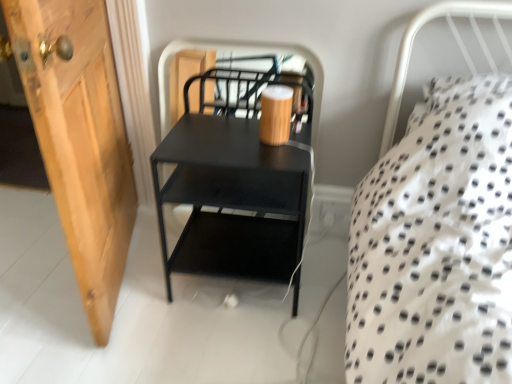
The width and height of the screenshot is (512, 384). I want to click on black matte nightstand at center, so click(x=232, y=200).

Describe the element at coordinates (232, 200) in the screenshot. I see `black matte nightstand at center` at that location.

This screenshot has height=384, width=512. I want to click on wooden door at left, so click(x=80, y=141).

What do you see at coordinates (80, 141) in the screenshot?
I see `wooden door at left` at bounding box center [80, 141].

You are a GUI agent. You are given a task and a screenshot of the screen. Output one action in this format:
    pyautogui.click(x=<x>, y=<y>)
    Task: Click on the black matte nightstand at center
    Image resolution: width=512 pixels, height=384 pixels.
    Given the screenshot: What is the action you would take?
    pyautogui.click(x=232, y=200)

Can you confirm if wooden door at left is positioned to the left of black matte nightstand at center?

Yes, wooden door at left is to the left of black matte nightstand at center.

Which object is more forward, wooden door at left or black matte nightstand at center?

wooden door at left is closer to the camera.

Which is behind, point (64, 203) or point (159, 189)?

Point (159, 189)

From the image's perspective, is wooden door at left positioned above or below black matte nightstand at center?

wooden door at left is above black matte nightstand at center.

Consider the image. From a real-world perspective, is wooden door at left above or below black matte nightstand at center?

wooden door at left is above black matte nightstand at center.

Consider the image. Considering the sizes of objects wooden door at left and black matte nightstand at center in the image provided, who is wider, wooden door at left or black matte nightstand at center?

With larger width is wooden door at left.

Who is shorter, wooden door at left or black matte nightstand at center?

Standing shorter between the two is black matte nightstand at center.

Is wooden door at left bigger or smaller than black matte nightstand at center?

wooden door at left is smaller than black matte nightstand at center.

Is wooden door at left surrounding black matte nightstand at center?

No, black matte nightstand at center is not inside wooden door at left.

Is wooden door at left beside black matte nightstand at center?

No, wooden door at left is not in contact with black matte nightstand at center.

From the picture: Is black matte nightstand at center at the back of wooden door at left?

wooden door at left does not have its back to black matte nightstand at center.

What's the angular difference between wooden door at left and black matte nightstand at center's facing directions?

15.8 degrees separate the facing orientations of wooden door at left and black matte nightstand at center.

How much distance is there between wooden door at left and black matte nightstand at center?

wooden door at left and black matte nightstand at center are 13.48 inches apart.

This screenshot has width=512, height=384. What are the coordinates of `nightstand below the wooden door at left (from the image's perspective)` in the screenshot? It's located at (232, 200).

Is black matte nightstand at center to the left or to the right of wooden door at left in the image?

From the image, it's evident that black matte nightstand at center is to the right of wooden door at left.

Is black matte nightstand at center positioned behind wooden door at left?

Yes, it is behind wooden door at left.

Based on the photo, which is nearer, (x=219, y=241) or (x=46, y=141)?

Positioned in front is point (x=46, y=141).

From the image's perspective, relative to wooden door at left, is black matte nightstand at center above or below?

From the image's perspective, black matte nightstand at center appears below wooden door at left.

From a real-world perspective, who is located lower, black matte nightstand at center or wooden door at left?

black matte nightstand at center is physically lower.

In terms of width, does black matte nightstand at center look wider or thinner when compared to wooden door at left?

In the image, black matte nightstand at center appears to be more narrow than wooden door at left.

Is black matte nightstand at center taller than wooden door at left?

No, black matte nightstand at center is not taller than wooden door at left.

Considering the sizes of objects black matte nightstand at center and wooden door at left in the image provided, who is smaller, black matte nightstand at center or wooden door at left?

wooden door at left.

Is wooden door at left completely or partially inside black matte nightstand at center?

No, wooden door at left is not a part of black matte nightstand at center.

Is black matte nightstand at center not near wooden door at left?

No, black matte nightstand at center is not far away from wooden door at left.

Based on the photo, is black matte nightstand at center facing away from wooden door at left?

No, black matte nightstand at center is not facing the opposite direction of wooden door at left.

How much distance is there between black matte nightstand at center and wooden door at left?

They are 13.48 inches apart.

Where is `nightstand located behind the wooden door at left`? This screenshot has height=384, width=512. nightstand located behind the wooden door at left is located at coordinates click(x=232, y=200).

Find the location of a particular element. The height and width of the screenshot is (384, 512). door positioned vertically above the black matte nightstand at center (from a real-world perspective) is located at coordinates (80, 141).

You are a GUI agent. You are given a task and a screenshot of the screen. Output one action in this format:
    pyautogui.click(x=<x>, y=<y>)
    Task: Click on the door in front of the black matte nightstand at center
    The width and height of the screenshot is (512, 384).
    Given the screenshot: What is the action you would take?
    pyautogui.click(x=80, y=141)